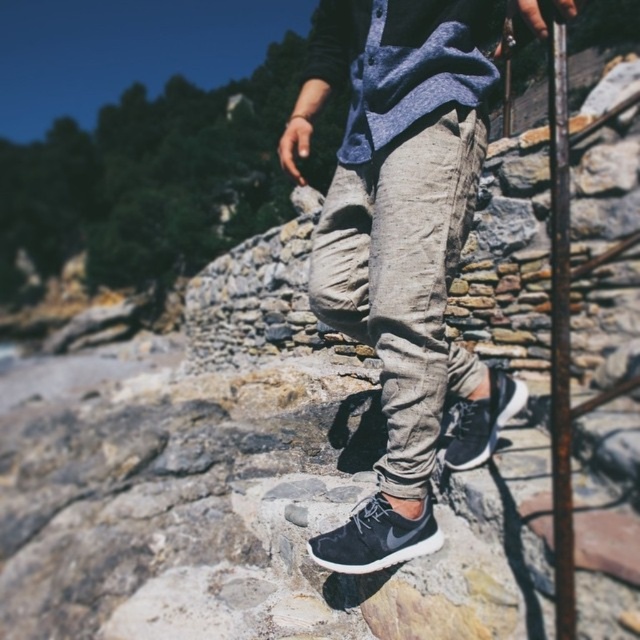
Is gray cotton pants at center bigger than matte black sneaker at lower center?

Yes, gray cotton pants at center is bigger than matte black sneaker at lower center.

Does gray cotton pants at center have a greater height compared to matte black sneaker at lower center?

Correct, gray cotton pants at center is much taller as matte black sneaker at lower center.

Identify the location of gray cotton pants at center. Image resolution: width=640 pixels, height=640 pixels. (401, 248).

Based on the photo, is gray cotton pants at center wider than dark gray suede sneaker at lower center?

Yes, gray cotton pants at center is wider than dark gray suede sneaker at lower center.

Between gray cotton pants at center and dark gray suede sneaker at lower center, which one appears on the right side from the viewer's perspective?

Positioned to the right is gray cotton pants at center.

Which is in front, point (301, 118) or point (365, 548)?

Point (365, 548) is more forward.

This screenshot has width=640, height=640. Identify the location of gray cotton pants at center. pyautogui.click(x=401, y=248).

Based on the photo, is dark gray suede sneaker at lower center shorter than matte black sneaker at lower center?

Correct, dark gray suede sneaker at lower center is not as tall as matte black sneaker at lower center.

Between point (339, 548) and point (477, 408), which one is positioned behind?

Point (477, 408)

Find the location of a particular element. The image size is (640, 640). dark gray suede sneaker at lower center is located at coordinates (376, 538).

Where is `dark gray suede sneaker at lower center`? This screenshot has height=640, width=640. dark gray suede sneaker at lower center is located at coordinates (x=376, y=538).